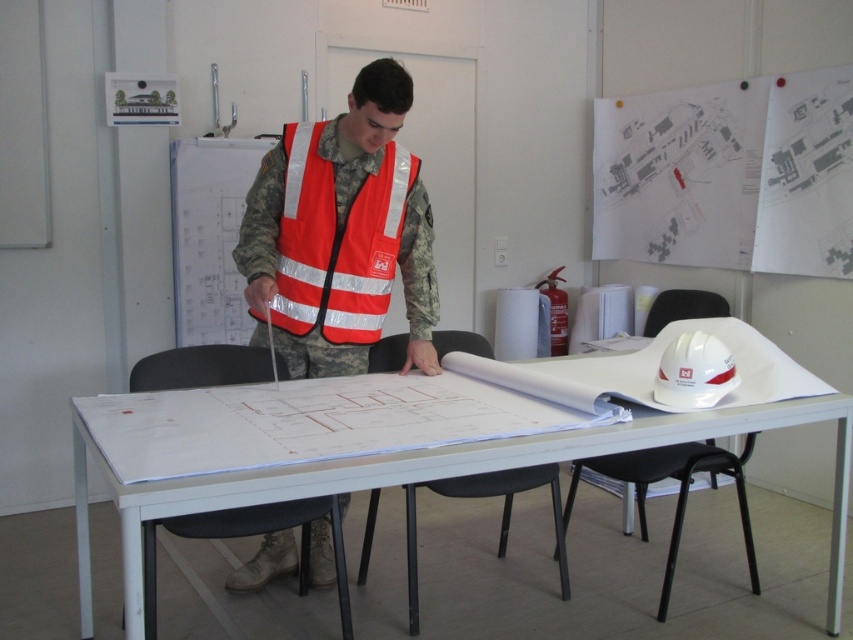
You are an inspector checking the safety equipment in the room. You see the white plastic table at center and the reflective orange safety vest at center. Which object is wider?

The white plastic table at center is wider than the reflective orange safety vest at center.

You are an inspector in the room and need to check the distance between the white plastic table at center and the reflective orange safety vest at center. According to the scene, which object is positioned to the right?

The white plastic table at center is to the right of the reflective orange safety vest at center, so the table is positioned to the right.